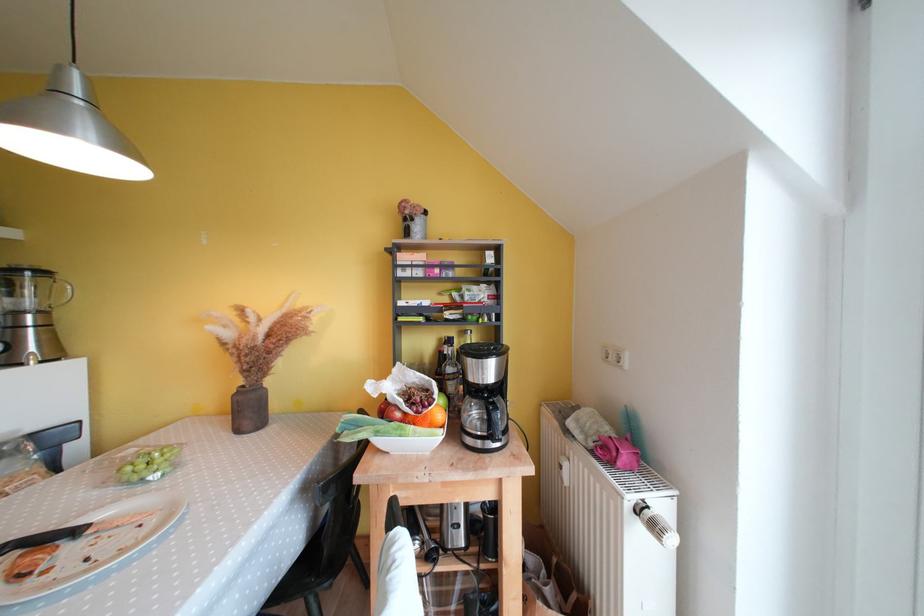
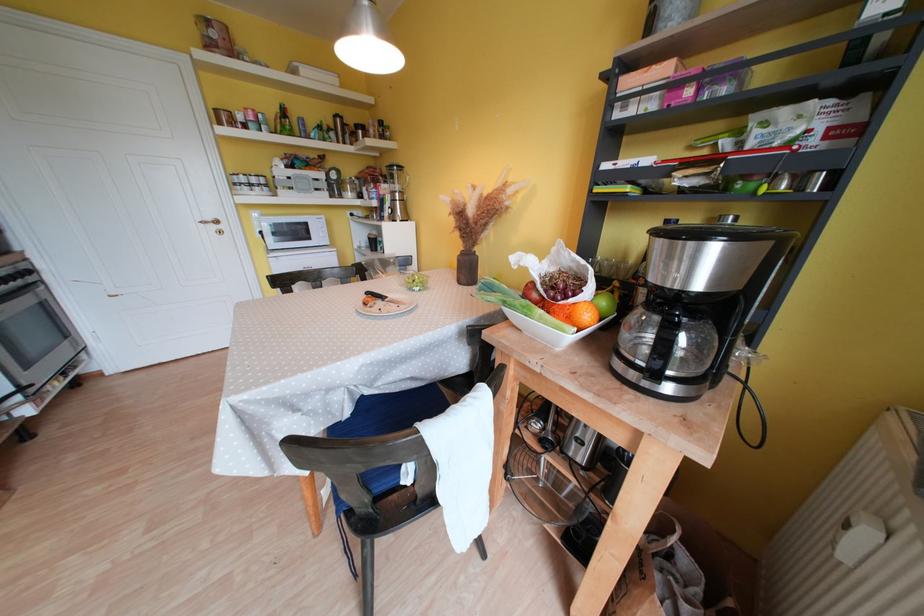
In the second image, find the point that corresponds to [573,487] in the first image.

(850, 562)